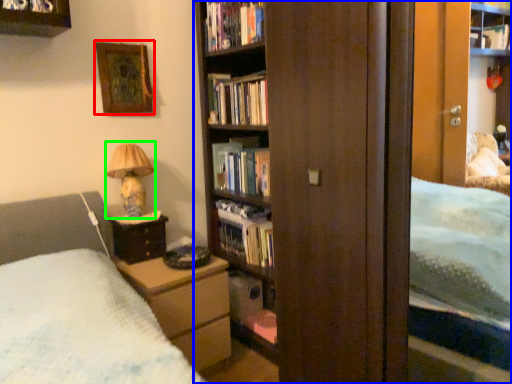
Question: Based on their relative distances, which object is farther from picture frame (highlighted by a red box)? Choose from bookcase (highlighted by a blue box) and table lamp (highlighted by a green box).

Choices:
 (A) bookcase
 (B) table lamp

Answer: (A)